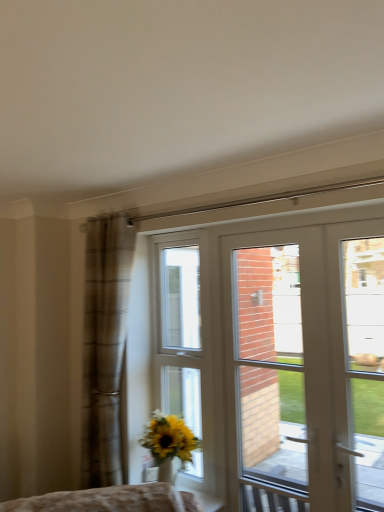
Measure the distance between point (x=170, y=346) and camera.

The depth of point (x=170, y=346) is 4.09 meters.

The width and height of the screenshot is (384, 512). In order to click on white glass door at right in this screenshot , I will do [x=365, y=362].

The width and height of the screenshot is (384, 512). Find the location of `brown plaid curtain at left`. brown plaid curtain at left is located at coordinates (104, 344).

In terms of height, does white glass door at right look taller or shorter compared to brown plaid curtain at left?

Clearly, white glass door at right is shorter compared to brown plaid curtain at left.

Can we say white glass door at right lies outside brown plaid curtain at left?

white glass door at right lies outside brown plaid curtain at left's area.

How distant is white glass door at right from brown plaid curtain at left?

They are 1.26 meters apart.

Which object is wider, white glass door at right or brown plaid curtain at left?

Wider between the two is white glass door at right.

How distant is white glossy window at center from white glossy door at center?

1.77 meters.

Could you tell me if white glossy window at center is turned towards white glossy door at center?

No, white glossy window at center does not turn towards white glossy door at center.

From the image's perspective, is white glossy window at center over white glossy door at center?

Incorrect, from the image's perspective, white glossy window at center is lower than white glossy door at center.

I want to click on door to the right of white glossy window at center, so click(308, 365).

Is the depth of white glossy door at center greater than that of white glass door at right?

Yes, white glossy door at center is further from the viewer.

Choose the correct answer: Is white glossy door at center inside white glass door at right or outside it?

white glossy door at center exists outside the volume of white glass door at right.

Which object is positioned more to the left, white glossy door at center or white glass door at right?

Positioned to the left is white glossy door at center.

Does point (345, 426) appear closer or farther from the camera than point (357, 412)?

Clearly, point (345, 426) is more distant from the camera than point (357, 412).

Between brown plaid curtain at left and white glossy door at center, which one is positioned behind?

brown plaid curtain at left.

Is brown plaid curtain at left not within white glossy door at center?

Absolutely, brown plaid curtain at left is external to white glossy door at center.

What's the angular difference between brown plaid curtain at left and white glossy door at center's facing directions?

They differ by 1.7 degrees in their facing directions.

Is brown plaid curtain at left to the left of white glossy door at center from the viewer's perspective?

Correct, you'll find brown plaid curtain at left to the left of white glossy door at center.

Which object is closer to the camera taking this photo, white glass door at right or white glossy window at center?

white glass door at right.

From the image's perspective, which one is positioned higher, white glass door at right or white glossy window at center?

From the image's view, white glass door at right is above.

Considering the relative sizes of white glass door at right and white glossy window at center in the image provided, is white glass door at right bigger than white glossy window at center?

Correct, white glass door at right is larger in size than white glossy window at center.

From a real-world perspective, which is physically above, white glass door at right or white glossy window at center?

white glass door at right is physically above.

From their relative heights in the image, would you say white glossy door at center is taller or shorter than white glossy window at center?

white glossy door at center is taller than white glossy window at center.

From a real-world perspective, which is physically above, white glossy door at center or white glossy window at center?

white glossy window at center is physically above.

Considering the points (265, 241) and (166, 377), which point is behind, point (265, 241) or point (166, 377)?

The point (166, 377) is farther from the camera.

Is white glossy door at center oriented towards white glossy window at center?

No, white glossy door at center is not oriented towards white glossy window at center.

Does point (96, 474) come behind point (378, 430)?

Yes, point (96, 474) is farther from viewer.

Considering their positions, is brown plaid curtain at left located in front of or behind white glass door at right?

Clearly, brown plaid curtain at left is behind white glass door at right.

Between brown plaid curtain at left and white glass door at right, which one has smaller size?

white glass door at right is smaller.

Identify the location of glass door lying on the right of brown plaid curtain at left. (365, 362).

At what (x,y) coordinates should I click in order to perform the action: click on bay window located above the white glossy door at center (from a real-world perspective). Please return your answer as a coordinate pair (x, y). The height and width of the screenshot is (512, 384). Looking at the image, I should click on (179, 329).

Which object lies further to the anchor point white glass door at right, white glossy door at center or white glossy window at center?

white glossy window at center.

Consider the image. From the image, which object appears to be farther from white glass door at right, white glossy window at center or white glossy door at center?

white glossy window at center lies further to white glass door at right than the other object.

When comparing their distances from white glass door at right, does white glossy door at center or brown plaid curtain at left seem further?

brown plaid curtain at left.

Considering their positions, is brown plaid curtain at left positioned closer to white glossy window at center than white glossy door at center?

brown plaid curtain at left is closer to white glossy window at center.

From the image, which object appears to be farther from white glass door at right, brown plaid curtain at left or white glossy door at center?

brown plaid curtain at left is positioned further to the anchor white glass door at right.

Consider the image. Based on their spatial positions, is white glossy window at center or brown plaid curtain at left closer to white glossy door at center?

Among the two, brown plaid curtain at left is located nearer to white glossy door at center.

Considering their positions, is white glossy door at center positioned further to brown plaid curtain at left than white glass door at right?

Among the two, white glass door at right is located further to brown plaid curtain at left.

Based on the photo, looking at the image, which one is located closer to brown plaid curtain at left, white glossy window at center or white glossy door at center?

Among the two, white glossy door at center is located nearer to brown plaid curtain at left.

The width and height of the screenshot is (384, 512). I want to click on bay window located between brown plaid curtain at left and white glass door at right in the left-right direction, so click(x=179, y=329).

In order to click on door between brown plaid curtain at left and white glass door at right from left to right in this screenshot , I will do `click(308, 365)`.

Identify the location of bay window between brown plaid curtain at left and white glossy door at center. (179, 329).

I want to click on door between white glossy window at center and white glass door at right from left to right, so click(x=308, y=365).